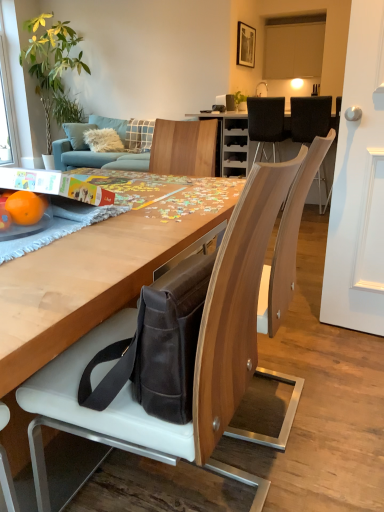
Question: Is green leafy plant at upper left positioned in front of black leather chair at upper center, positioned as the 1th chair in top-to-bottom order?

Choices:
 (A) yes
 (B) no

Answer: (B)

Question: Is green leafy plant at upper left facing towards black leather chair at upper center, acting as the third chair starting from the front?

Choices:
 (A) yes
 (B) no

Answer: (B)

Question: From a real-world perspective, is green leafy plant at upper left on black leather chair at upper center, which is the second chair in left-to-right order?

Choices:
 (A) yes
 (B) no

Answer: (A)

Question: Is green leafy plant at upper left in contact with black leather chair at upper center, which is the second chair in left-to-right order?

Choices:
 (A) no
 (B) yes

Answer: (A)

Question: Considering the relative sizes of green leafy plant at upper left and black leather chair at upper center, acting as the third chair starting from the front, in the image provided, is green leafy plant at upper left wider than black leather chair at upper center, acting as the third chair starting from the front,?

Choices:
 (A) no
 (B) yes

Answer: (B)

Question: Is green leafy plant at upper left outside of black leather chair at upper center, which is counted as the third chair, starting from the bottom?

Choices:
 (A) no
 (B) yes

Answer: (B)

Question: Is orangesmoothfruit at left positioned with its back to black leather chair at upper right, which ranks as the second chair in back-to-front order?

Choices:
 (A) no
 (B) yes

Answer: (B)

Question: Does orangesmoothfruit at left have a lesser width compared to black leather chair at upper right, arranged as the second chair when ordered from the bottom?

Choices:
 (A) yes
 (B) no

Answer: (A)

Question: Does orangesmoothfruit at left appear on the left side of black leather chair at upper right, placed as the second chair when sorted from front to back?

Choices:
 (A) yes
 (B) no

Answer: (A)

Question: Is orangesmoothfruit at left closer to camera compared to black leather chair at upper right, marked as the 3th chair in a left-to-right arrangement?

Choices:
 (A) yes
 (B) no

Answer: (A)

Question: Is orangesmoothfruit at left positioned behind black leather chair at upper right, arranged as the second chair when ordered from the bottom?

Choices:
 (A) yes
 (B) no

Answer: (B)

Question: Is orangesmoothfruit at left aimed at black leather chair at upper right, marked as the 3th chair in a left-to-right arrangement?

Choices:
 (A) no
 (B) yes

Answer: (A)

Question: Is orangesmoothfruit at left touching dark brown leather messenger bag at center?

Choices:
 (A) yes
 (B) no

Answer: (B)